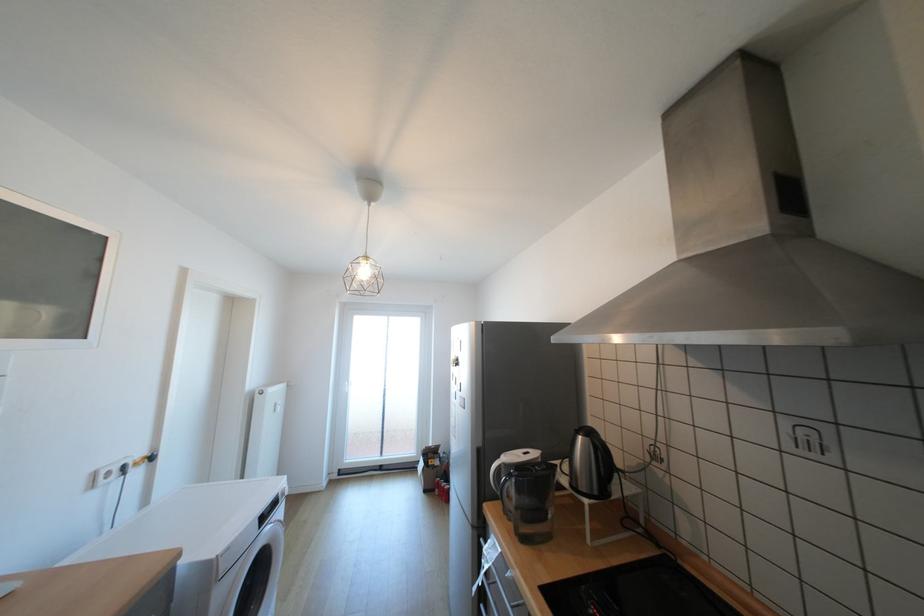
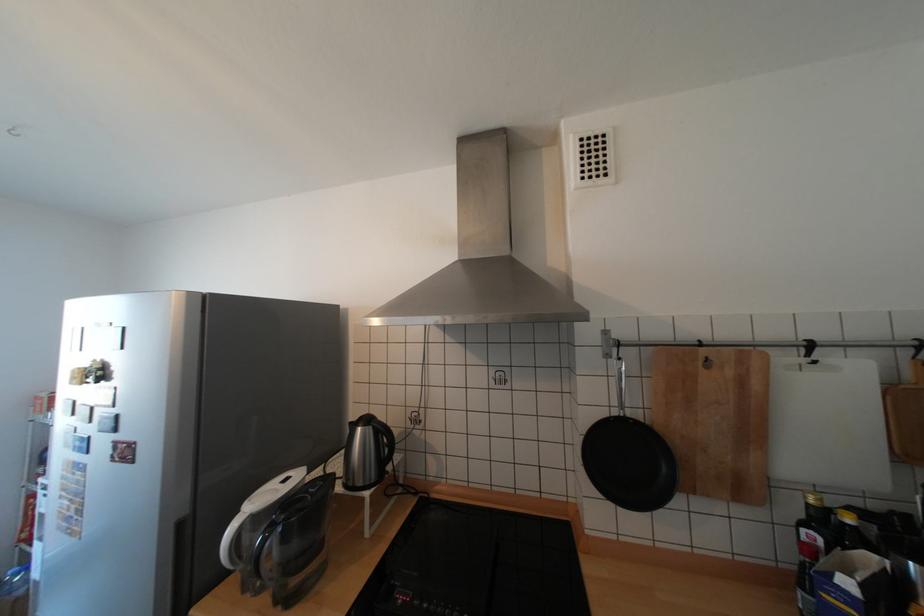
In the second image, find the point that corresponds to (466,362) in the first image.

(108, 373)